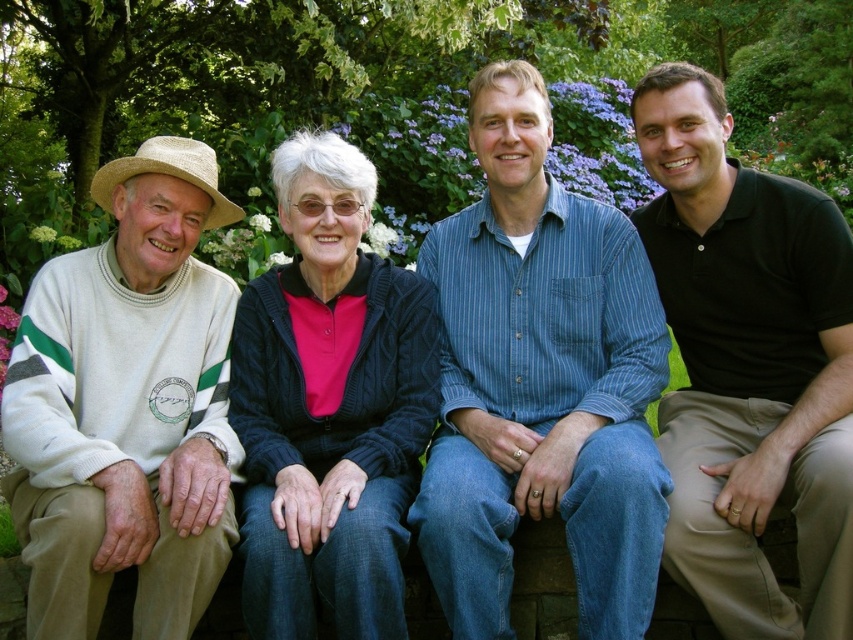
Question: Considering the real-world distances, which object is farthest from the blue striped shirt at center?

Choices:
 (A) black cotton polo shirt at right
 (B) white knit sweater at left

Answer: (B)

Question: Which object appears farthest from the camera in this image?

Choices:
 (A) blue striped shirt at center
 (B) black cotton polo shirt at right

Answer: (A)

Question: Based on their relative distances, which object is nearer to the blue striped shirt at center?

Choices:
 (A) cable-knit sweater at center
 (B) black cotton polo shirt at right
 (C) white knit sweater at left

Answer: (B)

Question: Is white knit sweater at left bigger than black cotton polo shirt at right?

Choices:
 (A) no
 (B) yes

Answer: (B)

Question: Does black cotton polo shirt at right have a greater width compared to cable-knit sweater at center?

Choices:
 (A) yes
 (B) no

Answer: (B)

Question: Does white knit sweater at left have a greater width compared to cable-knit sweater at center?

Choices:
 (A) no
 (B) yes

Answer: (B)